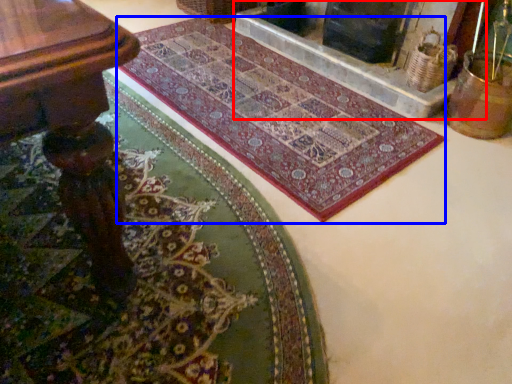
Question: Which point is further to the camera, fireplace (highlighted by a red box) or mat (highlighted by a blue box)?

Choices:
 (A) fireplace
 (B) mat

Answer: (A)